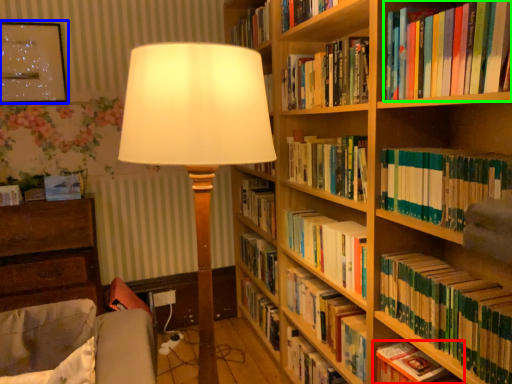
Question: Which object is the farthest from book (highlighted by a red box)? Choose among these: picture frame (highlighted by a blue box) or book (highlighted by a green box).

Choices:
 (A) picture frame
 (B) book

Answer: (A)